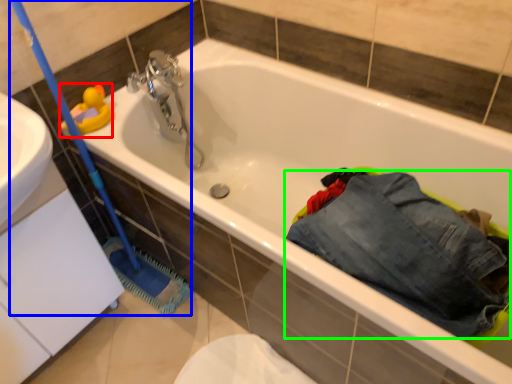
Question: Considering the real-world distances, which object is closest to toy (highlighted by a red box)? brush (highlighted by a blue box) or trousers (highlighted by a green box).

Choices:
 (A) brush
 (B) trousers

Answer: (A)